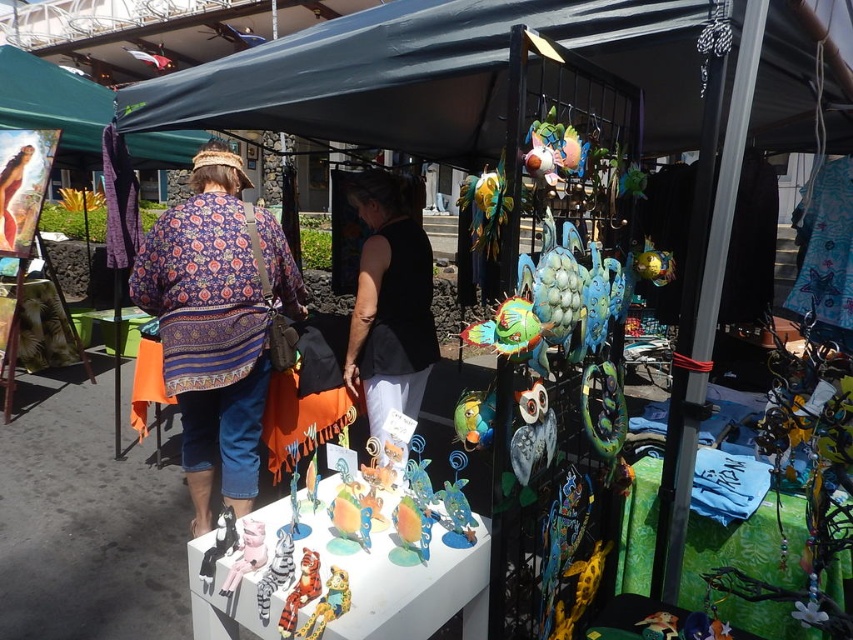
Question: Is dark green fabric canopy at upper center below black matte tank top at center?

Choices:
 (A) yes
 (B) no

Answer: (B)

Question: Does patterned fabric shirt at center have a smaller size compared to black matte tank top at center?

Choices:
 (A) yes
 (B) no

Answer: (B)

Question: Among these objects, which one is nearest to the camera?

Choices:
 (A) black matte tank top at center
 (B) patterned fabric shirt at center
 (C) dark green fabric canopy at upper center

Answer: (C)

Question: Does dark green fabric canopy at upper center have a greater width compared to black matte tank top at center?

Choices:
 (A) no
 (B) yes

Answer: (B)

Question: Which point is farther to the camera?

Choices:
 (A) patterned fabric shirt at center
 (B) black matte tank top at center

Answer: (B)

Question: Estimate the real-world distances between objects in this image. Which object is farther from the dark green fabric canopy at upper center?

Choices:
 (A) black matte tank top at center
 (B) patterned fabric shirt at center

Answer: (B)